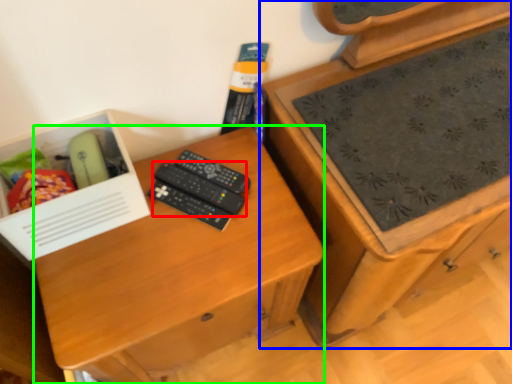
Question: Which is nearer to the remote control (highlighted by a red box)? chest of drawers (highlighted by a blue box) or desk (highlighted by a green box).

Choices:
 (A) chest of drawers
 (B) desk

Answer: (B)